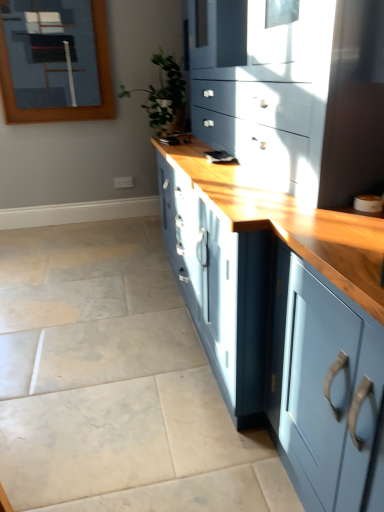
Describe the element at coordinates (284, 319) in the screenshot. I see `matte blue cabinet at center` at that location.

Locate an element on the screen. This screenshot has width=384, height=512. green leafy plant at center is located at coordinates (163, 96).

Looking at this image, is green leafy plant at center completely or partially inside matte blue cabinet at center?

Yes, green leafy plant at center is a part of matte blue cabinet at center.

Between matte blue cabinet at center and green leafy plant at center, which one has less height?

With less height is green leafy plant at center.

From a real-world perspective, is matte blue cabinet at center positioned over green leafy plant at center based on gravity?

No, from a real-world perspective, matte blue cabinet at center is not over green leafy plant at center

Based on their sizes in the image, would you say matte blue cabinet at center is bigger or smaller than green leafy plant at center?

Clearly, matte blue cabinet at center is larger in size than green leafy plant at center.

Looking at this image, is green leafy plant at center in contact with wooden frame at upper left?

No, green leafy plant at center is not making contact with wooden frame at upper left.

From a real-world perspective, is green leafy plant at center above or below wooden frame at upper left?

Clearly, from a real-world perspective, green leafy plant at center is below wooden frame at upper left.

How many degrees apart are the facing directions of green leafy plant at center and wooden frame at upper left?

The facing directions of green leafy plant at center and wooden frame at upper left are 94.3 degrees apart.

From the picture: Considering the relative sizes of green leafy plant at center and wooden frame at upper left in the image provided, is green leafy plant at center thinner than wooden frame at upper left?

No, green leafy plant at center is not thinner than wooden frame at upper left.

Does point (358, 438) come closer to viewer compared to point (66, 59)?

That is True.

Is matte blue cabinet at center at the left side of wooden frame at upper left?

No.

Is wooden frame at upper left at the back of matte blue cabinet at center?

No, wooden frame at upper left is not at the back of matte blue cabinet at center.

From the image's perspective, is matte blue cabinet at center above or below wooden frame at upper left?

Based on their image positions, matte blue cabinet at center is located beneath wooden frame at upper left.

From the picture: Is wooden frame at upper left facing towards green leafy plant at center?

No, wooden frame at upper left does not turn towards green leafy plant at center.

From the image's perspective, is wooden frame at upper left above or below green leafy plant at center?

wooden frame at upper left is situated higher than green leafy plant at center in the image.

Is wooden frame at upper left directly adjacent to green leafy plant at center?

No.

From a real-world perspective, does wooden frame at upper left stand above green leafy plant at center?

Indeed, from a real-world perspective, wooden frame at upper left stands above green leafy plant at center.

Would you say green leafy plant at center is inside or outside matte blue cabinet at center?

green leafy plant at center is contained in matte blue cabinet at center.

Is green leafy plant at center positioned with its back to matte blue cabinet at center?

Yes.

From the image's perspective, which is below, green leafy plant at center or matte blue cabinet at center?

matte blue cabinet at center appears lower in the image.

Is point (165, 124) closer or farther from the camera than point (225, 323)?

Clearly, point (165, 124) is more distant from the camera than point (225, 323).

From the image's perspective, relative to matte blue cabinet at center, is wooden frame at upper left above or below?

From the image's perspective, wooden frame at upper left appears above matte blue cabinet at center.

From a real-world perspective, relative to matte blue cabinet at center, is wooden frame at upper left vertically above or below?

wooden frame at upper left is situated higher than matte blue cabinet at center in the real world.

Are wooden frame at upper left and matte blue cabinet at center making contact?

No, wooden frame at upper left is not in contact with matte blue cabinet at center.

The height and width of the screenshot is (512, 384). I want to click on houseplant behind the matte blue cabinet at center, so click(x=163, y=96).

You are a GUI agent. You are given a task and a screenshot of the screen. Output one action in this format:
    pyautogui.click(x=<x>, y=<y>)
    Task: Click on the houseplant in front of the wooden frame at upper left
    The image size is (384, 512).
    Given the screenshot: What is the action you would take?
    pyautogui.click(x=163, y=96)

Which object lies nearer to the anchor point matte blue cabinet at center, green leafy plant at center or wooden frame at upper left?

green leafy plant at center lies closer to matte blue cabinet at center than the other object.

Which object lies nearer to the anchor point green leafy plant at center, matte blue cabinet at center or wooden frame at upper left?

Among the two, wooden frame at upper left is located nearer to green leafy plant at center.

From the image, which object appears to be farther from wooden frame at upper left, matte blue cabinet at center or green leafy plant at center?

Based on the image, matte blue cabinet at center appears to be further to wooden frame at upper left.

Looking at the image, which one is located further to wooden frame at upper left, green leafy plant at center or matte blue cabinet at center?

Based on the image, matte blue cabinet at center appears to be further to wooden frame at upper left.

Based on the photo, when comparing their distances from matte blue cabinet at center, does wooden frame at upper left or green leafy plant at center seem further?

Based on the image, wooden frame at upper left appears to be further to matte blue cabinet at center.

Estimate the real-world distances between objects in this image. Which object is closer to green leafy plant at center, wooden frame at upper left or matte blue cabinet at center?

Among the two, wooden frame at upper left is located nearer to green leafy plant at center.

Image resolution: width=384 pixels, height=512 pixels. Find the location of `houseplant between matte blue cabinet at center and wooden frame at upper left along the z-axis`. houseplant between matte blue cabinet at center and wooden frame at upper left along the z-axis is located at coordinates (163, 96).